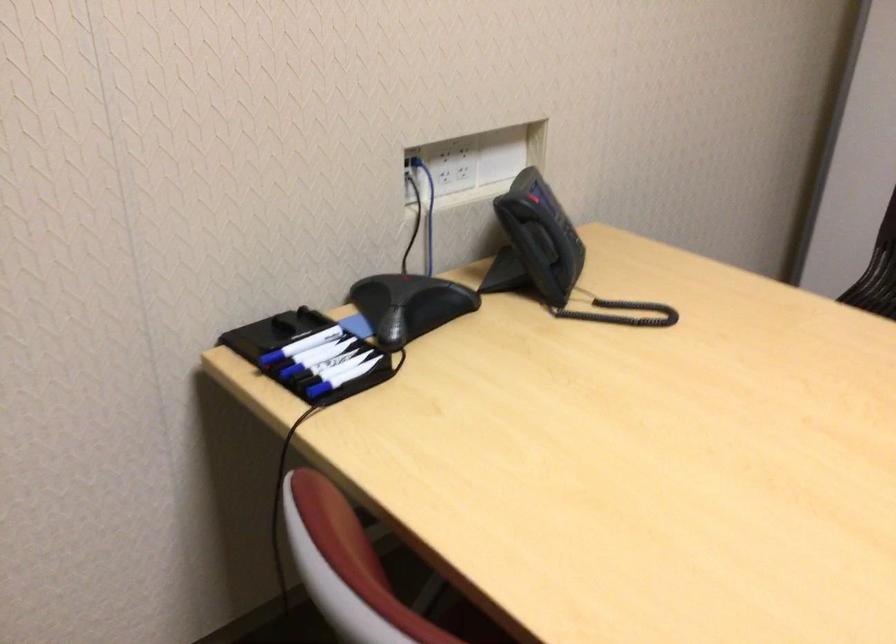
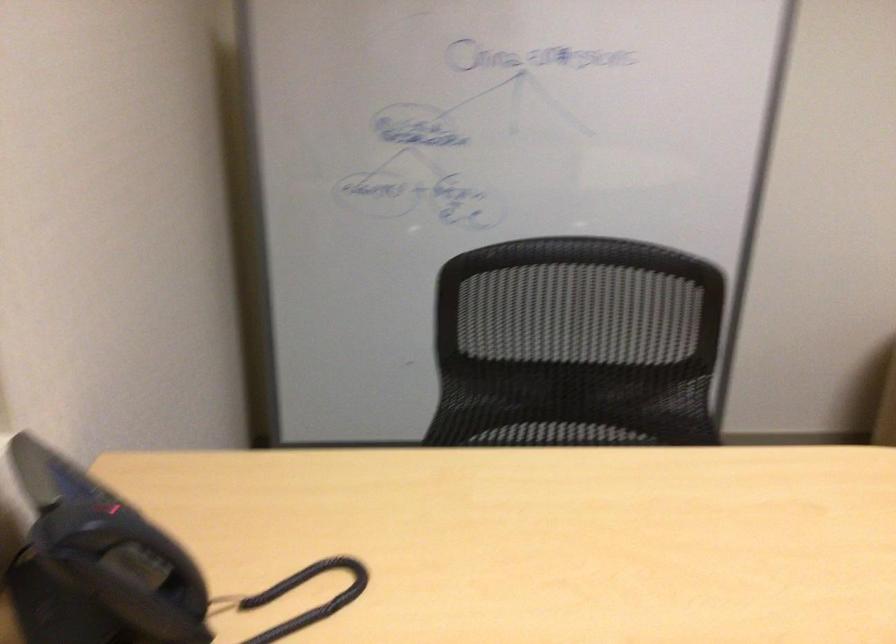
Question: The first image is from the beginning of the video and the second image is from the end. How did the camera likely rotate when shooting the video?

Choices:
 (A) Left
 (B) Right
 (C) Up
 (D) Down

Answer: (B)